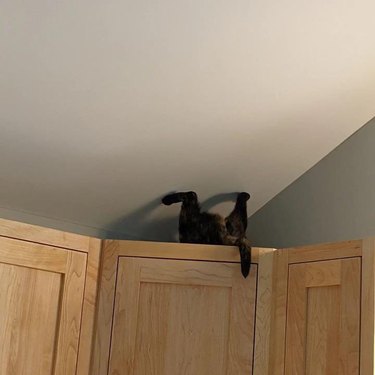
Identify the location of sage wall. (309, 213).